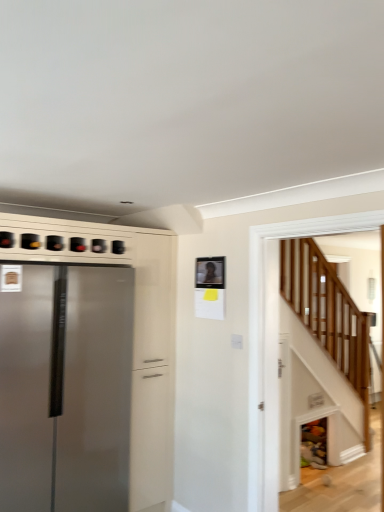
Question: Considering the relative sizes of wooden stairs at lower right and satin silver refrigerator at left in the image provided, is wooden stairs at lower right taller than satin silver refrigerator at left?

Choices:
 (A) no
 (B) yes

Answer: (A)

Question: Does wooden stairs at lower right have a lesser width compared to satin silver refrigerator at left?

Choices:
 (A) yes
 (B) no

Answer: (A)

Question: Is wooden stairs at lower right facing towards satin silver refrigerator at left?

Choices:
 (A) yes
 (B) no

Answer: (B)

Question: Can you confirm if wooden stairs at lower right is smaller than satin silver refrigerator at left?

Choices:
 (A) yes
 (B) no

Answer: (A)

Question: Is wooden stairs at lower right to the right of satin silver refrigerator at left from the viewer's perspective?

Choices:
 (A) yes
 (B) no

Answer: (A)

Question: Would you say wooden stairs at lower right contains satin silver refrigerator at left?

Choices:
 (A) no
 (B) yes

Answer: (A)

Question: Does satin silver refrigerator at left have a greater height compared to wooden stairs at lower right?

Choices:
 (A) yes
 (B) no

Answer: (A)

Question: Is satin silver refrigerator at left facing away from wooden stairs at lower right?

Choices:
 (A) no
 (B) yes

Answer: (A)

Question: Is the depth of satin silver refrigerator at left greater than that of wooden stairs at lower right?

Choices:
 (A) no
 (B) yes

Answer: (B)

Question: From a real-world perspective, is satin silver refrigerator at left physically above wooden stairs at lower right?

Choices:
 (A) no
 (B) yes

Answer: (A)

Question: Are satin silver refrigerator at left and wooden stairs at lower right located far from each other?

Choices:
 (A) yes
 (B) no

Answer: (A)

Question: Considering the relative positions of satin silver refrigerator at left and wooden stairs at lower right in the image provided, is satin silver refrigerator at left to the right of wooden stairs at lower right from the viewer's perspective?

Choices:
 (A) no
 (B) yes

Answer: (A)

Question: From a real-world perspective, is satin silver refrigerator at left physically located above or below wooden stairs at lower right?

Choices:
 (A) above
 (B) below

Answer: (B)